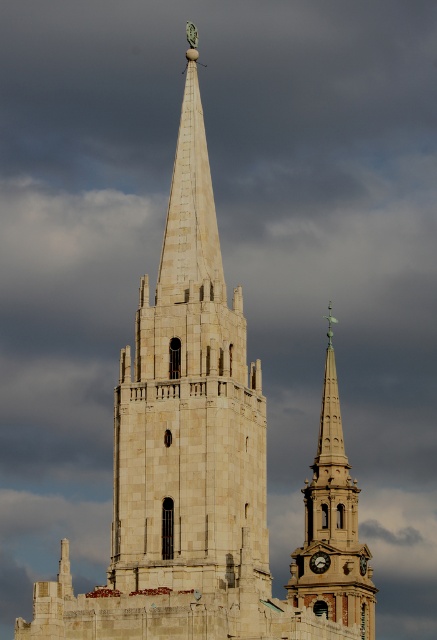
Based on the scene description, where is the smooth stone spire at center located in terms of coordinates?

The smooth stone spire at center is located at point coordinates of (332, 524).

You are standing in front of the two church spires and want to determine which point is nearer to you. The points are labeled as point 1 at coordinates point (145,348) and point 2 at coordinates point (323,566). Which point is closer to your position?

Point (145,348) is closer to the viewer than point (323,566).

You are standing in front of the two church spires. Which one would appear larger to you, the white stone steeple at center or the smooth stone spire at center?

The white stone steeple at center appears larger because it is closer to the viewer than the smooth stone spire at center.